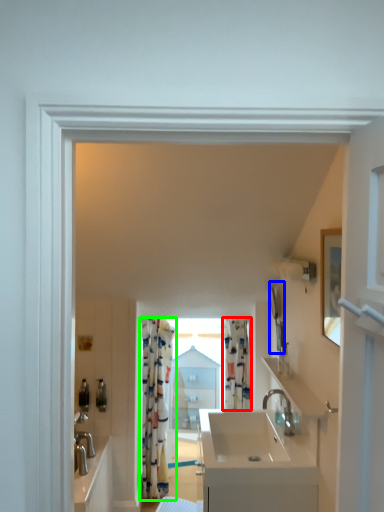
Question: Which is farther away from curtain (highlighted by a red box)? mirror (highlighted by a blue box) or curtain (highlighted by a green box)?

Choices:
 (A) mirror
 (B) curtain

Answer: (B)